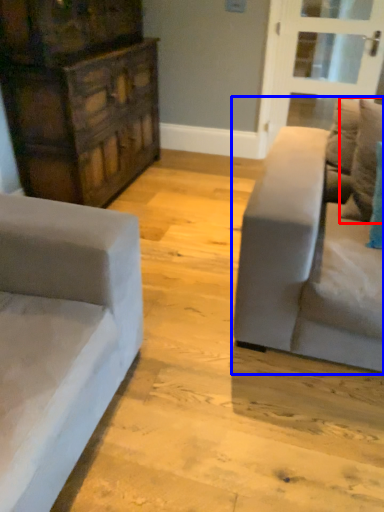
Question: Which object appears closest to the camera in this image, pillow (highlighted by a red box) or studio couch (highlighted by a blue box)?

Choices:
 (A) pillow
 (B) studio couch

Answer: (B)